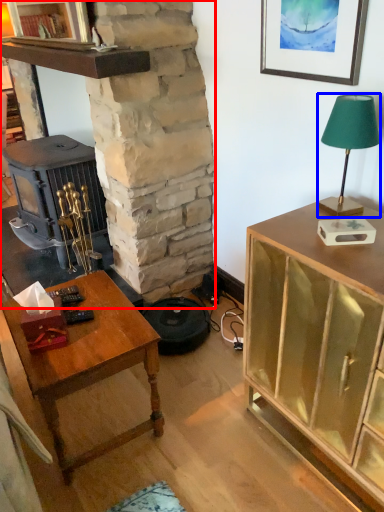
Question: Among these objects, which one is nearest to the camera, fireplace (highlighted by a red box) or lamp (highlighted by a blue box)?

Choices:
 (A) fireplace
 (B) lamp

Answer: (B)